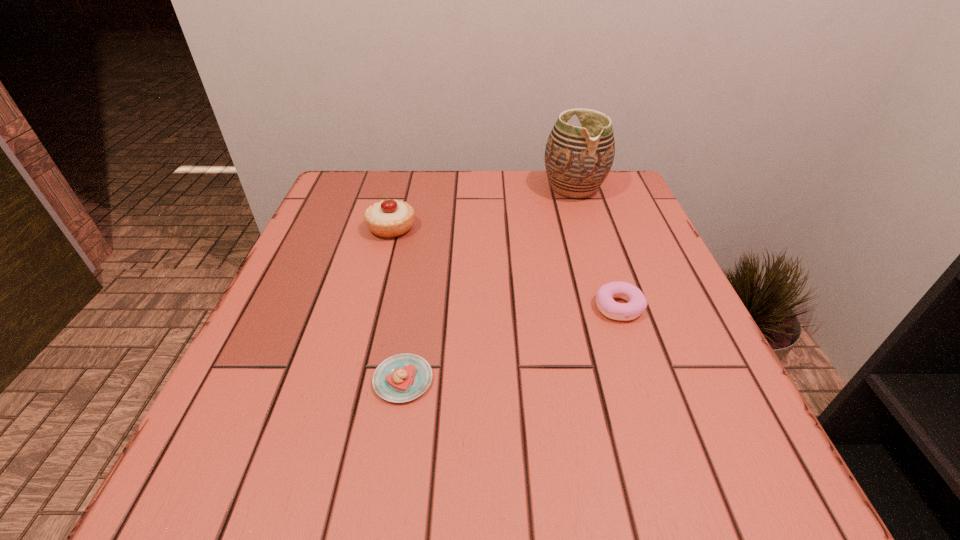
Where is `vacant space at the near edge of the desktop`? vacant space at the near edge of the desktop is located at coordinates (508, 448).

Where is `vacant point at the left edge`? vacant point at the left edge is located at coordinates (321, 280).

Identify the location of vacant space at the far left corner. Image resolution: width=960 pixels, height=540 pixels. (346, 182).

The height and width of the screenshot is (540, 960). Identify the location of free point between the second farthest object and the pottery. (483, 208).

You are a GUI agent. You are given a task and a screenshot of the screen. Output one action in this format:
    pyautogui.click(x=<x>, y=<y>)
    Task: Click on the free space between the second nearest pastry and the third shortest object
    This screenshot has width=960, height=540.
    Given the screenshot: What is the action you would take?
    pyautogui.click(x=505, y=267)

At what (x,y) coordinates should I click in order to perform the action: click on vacant area that lies between the pottery and the rightmost pastry. Please return your answer as a coordinate pair (x, y). The height and width of the screenshot is (540, 960). Looking at the image, I should click on (596, 247).

You are a GUI agent. You are given a task and a screenshot of the screen. Output one action in this format:
    pyautogui.click(x=<x>, y=<y>)
    Task: Click on the free space between the nearest object and the rightmost pastry
    
    Given the screenshot: What is the action you would take?
    pyautogui.click(x=511, y=343)

Where is `empty space that is in between the rightmost pastry and the tallest pastry`? empty space that is in between the rightmost pastry and the tallest pastry is located at coordinates (505, 267).

The image size is (960, 540). What are the coordinates of `vacant space in between the nearest pastry and the farthest pastry` in the screenshot? It's located at (397, 304).

Identify the location of vacant region between the farthest object and the second farthest object. (483, 208).